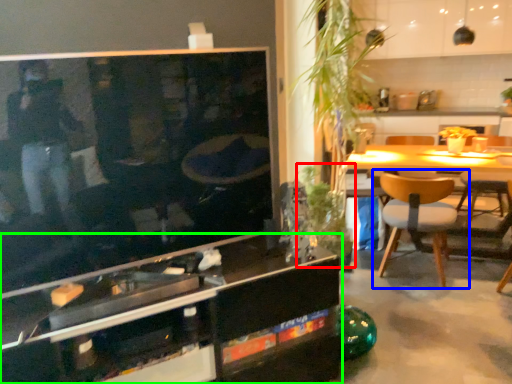
Question: Considering the real-world distances, which object is farthest from plant (highlighted by a red box)? chair (highlighted by a blue box) or cabinetry (highlighted by a green box)?

Choices:
 (A) chair
 (B) cabinetry

Answer: (B)